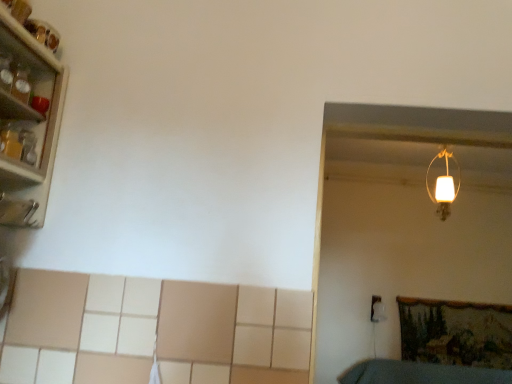
Question: Is point (442, 147) closer or farther from the camera than point (2, 100)?

Choices:
 (A) farther
 (B) closer

Answer: (A)

Question: Choose the correct answer: Is white matte lampshade at upper right inside metallic glassware at left or outside it?

Choices:
 (A) inside
 (B) outside

Answer: (B)

Question: Is white matte lampshade at upper right wider or thinner than metallic glassware at left?

Choices:
 (A) wide
 (B) thin

Answer: (B)

Question: Is metallic glassware at left bigger or smaller than white matte lampshade at upper right?

Choices:
 (A) small
 (B) big

Answer: (B)

Question: From their relative heights in the image, would you say metallic glassware at left is taller or shorter than white matte lampshade at upper right?

Choices:
 (A) short
 (B) tall

Answer: (A)

Question: Is metallic glassware at left in front of or behind white matte lampshade at upper right in the image?

Choices:
 (A) behind
 (B) front

Answer: (B)

Question: From a real-world perspective, is metallic glassware at left physically located above or below white matte lampshade at upper right?

Choices:
 (A) below
 (B) above

Answer: (A)